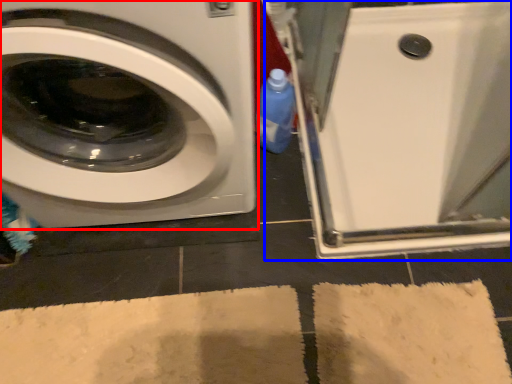
Question: Among these objects, which one is nearest to the camera, washing machine (highlighted by a red box) or machine (highlighted by a blue box)?

Choices:
 (A) washing machine
 (B) machine

Answer: (A)